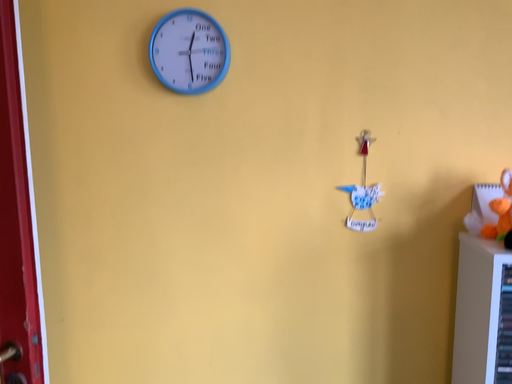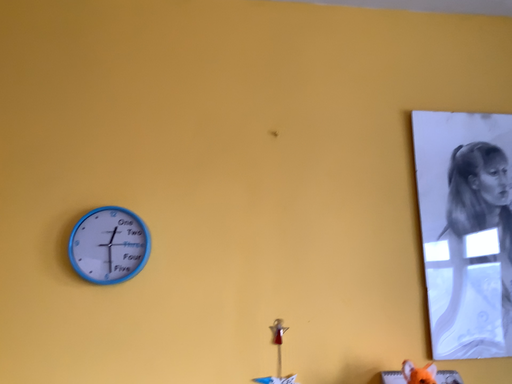
Question: Which way did the camera rotate in the video?

Choices:
 (A) rotated right
 (B) rotated left

Answer: (A)